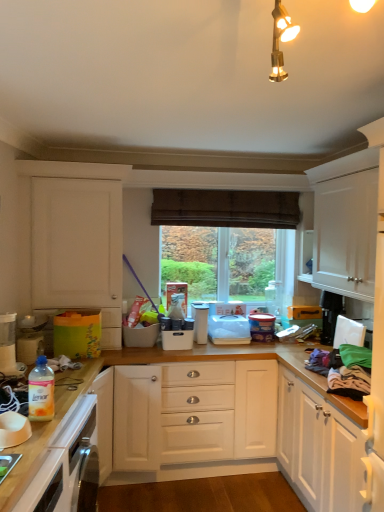
Question: Is white plastic container at center, placed as the fourth appliance when sorted from right to left, bigger or smaller than translucent plastic bottle at lower left?

Choices:
 (A) big
 (B) small

Answer: (B)

Question: Do you think white plastic container at center, placed as the fourth appliance when sorted from right to left, is within translucent plastic bottle at lower left, or outside of it?

Choices:
 (A) outside
 (B) inside

Answer: (A)

Question: Estimate the real-world distances between objects in this image. Which object is closer to the clear glass bottle at upper center, the 2th bottle positioned from the front?

Choices:
 (A) black plastic toaster at upper right, which appears as the first appliance when viewed from the right
 (B) translucent plastic bottle at lower left
 (C) white plastic container at center, acting as the 2th appliance starting from the left
 (D) white matte cabinet at left
 (E) purple matte canister at center, acting as the third appliance starting from the left

Answer: (E)

Question: Which of these objects is positioned closest to the black plastic toaster at upper right, which appears as the first appliance when viewed from the right?

Choices:
 (A) white plastic container at center, arranged as the third appliance when viewed from the right
 (B) purple matte canister at center, arranged as the 2th appliance when viewed from the right
 (C) white plastic bowl at lower left
 (D) clear glass window at center
 (E) brown textured curtain at center

Answer: (B)